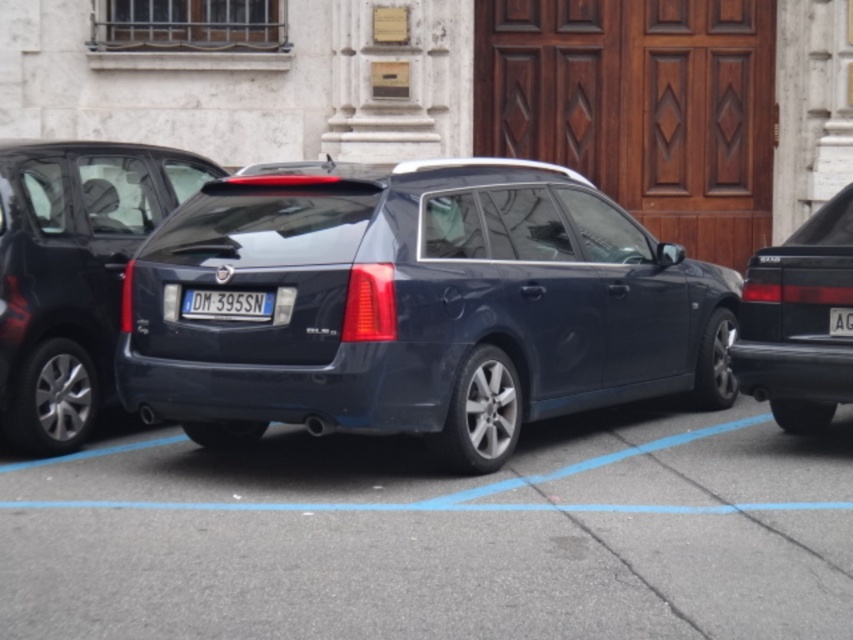
Question: Can you confirm if black glossy sedan at right is positioned below blue plastic license plate at center?

Choices:
 (A) yes
 (B) no

Answer: (A)

Question: Which object is farther from the camera taking this photo?

Choices:
 (A) satin black minivan at center
 (B) glossy dark blue car at center
 (C) white plastic license plate at center
 (D) dark blue car at center

Answer: (C)

Question: Which point appears farthest from the camera in this image?

Choices:
 (A) (416, 262)
 (B) (848, 333)
 (C) (234, 291)

Answer: (B)

Question: Is blue plastic license plate at center closer to camera compared to white plastic license plate at center?

Choices:
 (A) yes
 (B) no

Answer: (A)

Question: Is glossy dark blue car at center to the right of blue plastic license plate at center from the viewer's perspective?

Choices:
 (A) no
 (B) yes

Answer: (B)

Question: Which point is farther to the camera?

Choices:
 (A) satin black minivan at center
 (B) blue plastic license plate at center
 (C) dark blue car at center

Answer: (A)